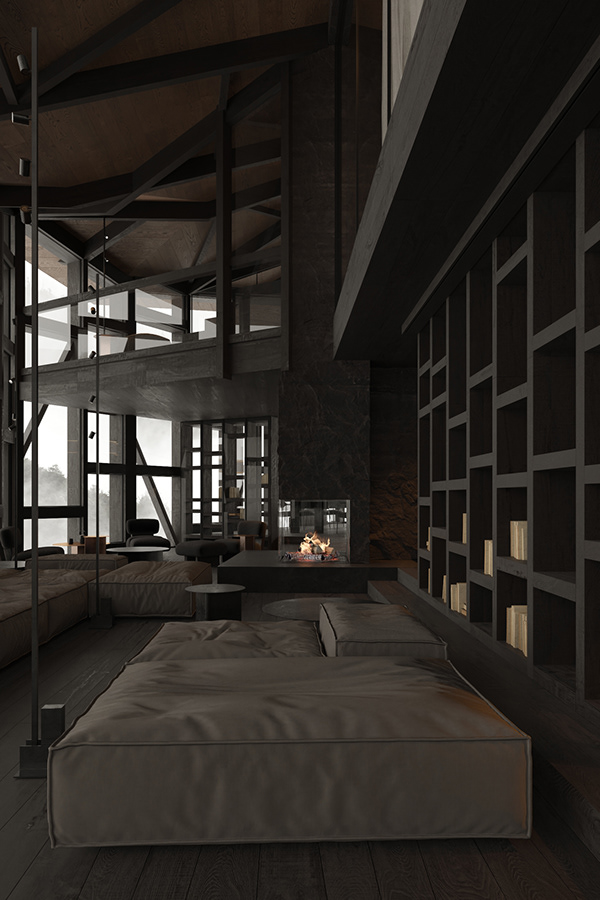
Image resolution: width=600 pixels, height=900 pixels. Find the location of `ceiling`. ceiling is located at coordinates (113, 117), (171, 249), (173, 31), (63, 22), (203, 187), (249, 226), (259, 172), (251, 136).